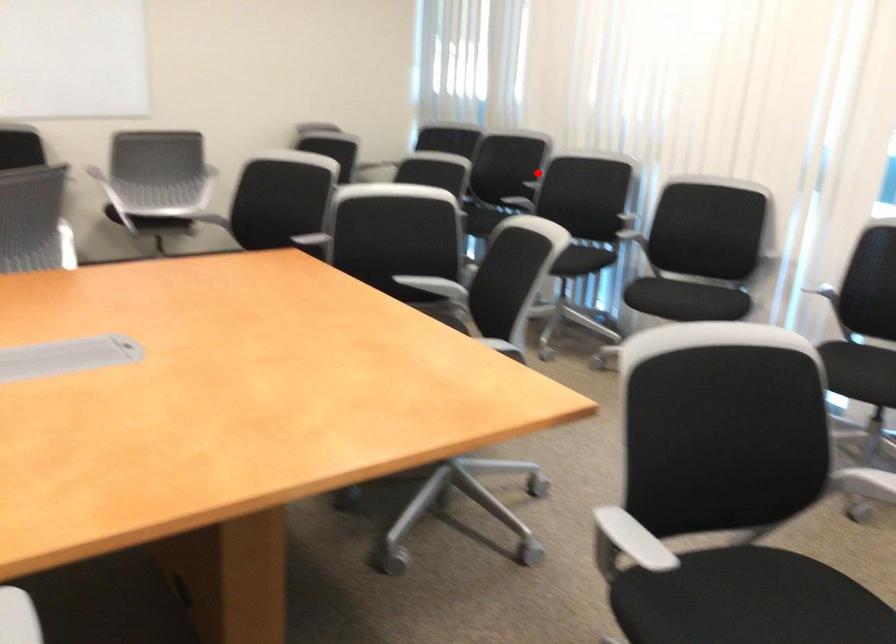
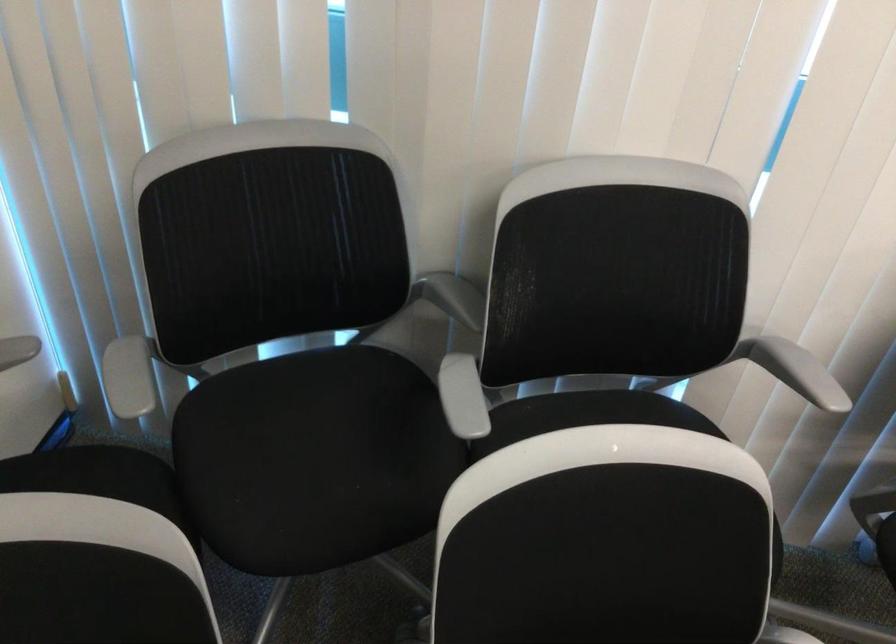
Locate, in the second image, the point that corresponds to the highlighted location in the first image.

(794, 370)